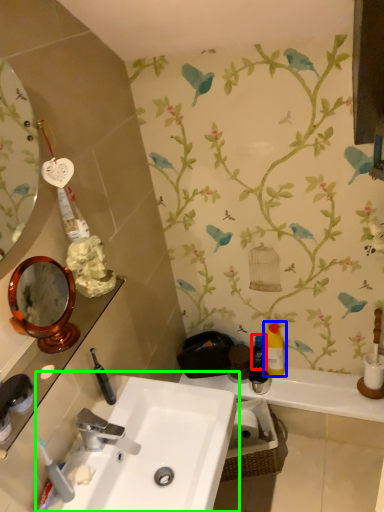
Question: Estimate the real-world distances between objects in this image. Which object is farther from mouthwash (highlighted by a red box), mouthwash (highlighted by a blue box) or sink (highlighted by a green box)?

Choices:
 (A) mouthwash
 (B) sink

Answer: (B)